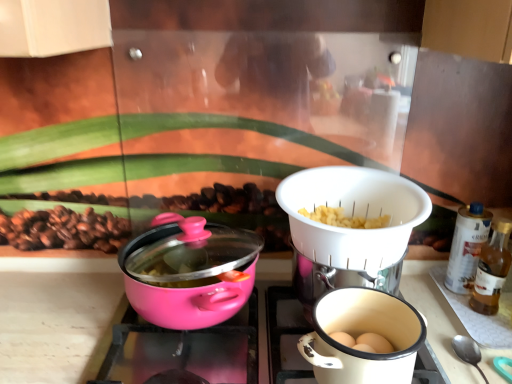
Question: Is matte white coffee cup at lower right bigger than white plastic strainer at center, which is counted as the 1th kitchen appliance, starting from the right?

Choices:
 (A) yes
 (B) no

Answer: (B)

Question: From a real-world perspective, does matte white coffee cup at lower right sit lower than white plastic strainer at center, which is counted as the 1th kitchen appliance, starting from the right?

Choices:
 (A) no
 (B) yes

Answer: (B)

Question: Is matte white coffee cup at lower right not close to white plastic strainer at center, which is counted as the 1th kitchen appliance, starting from the right?

Choices:
 (A) no
 (B) yes

Answer: (A)

Question: Considering the relative sizes of matte white coffee cup at lower right and white plastic strainer at center, marked as the 2th kitchen appliance in a left-to-right arrangement, in the image provided, is matte white coffee cup at lower right thinner than white plastic strainer at center, marked as the 2th kitchen appliance in a left-to-right arrangement,?

Choices:
 (A) yes
 (B) no

Answer: (A)

Question: Is matte white coffee cup at lower right oriented towards white plastic strainer at center, which is counted as the 1th kitchen appliance, starting from the right?

Choices:
 (A) yes
 (B) no

Answer: (B)

Question: In terms of width, does matte white coffee cup at lower right look wider or thinner when compared to white plastic strainer at center, which is counted as the 1th kitchen appliance, starting from the right?

Choices:
 (A) thin
 (B) wide

Answer: (A)

Question: Considering the positions of point (326, 360) and point (359, 241), is point (326, 360) closer or farther from the camera than point (359, 241)?

Choices:
 (A) farther
 (B) closer

Answer: (B)

Question: From a real-world perspective, relative to white plastic strainer at center, which is counted as the 1th kitchen appliance, starting from the right, is matte white coffee cup at lower right vertically above or below?

Choices:
 (A) below
 (B) above

Answer: (A)

Question: In terms of height, does matte white coffee cup at lower right look taller or shorter compared to white plastic strainer at center, marked as the 2th kitchen appliance in a left-to-right arrangement?

Choices:
 (A) tall
 (B) short

Answer: (B)

Question: From the image's perspective, is white plastic strainer at center, marked as the 2th kitchen appliance in a left-to-right arrangement, positioned above or below translucent glass bottle at right?

Choices:
 (A) below
 (B) above

Answer: (B)

Question: Does point (398, 187) appear closer or farther from the camera than point (497, 278)?

Choices:
 (A) closer
 (B) farther

Answer: (A)

Question: Relative to translucent glass bottle at right, is white plastic strainer at center, marked as the 2th kitchen appliance in a left-to-right arrangement, in front or behind?

Choices:
 (A) behind
 (B) front

Answer: (B)

Question: In the image, is white plastic strainer at center, which is counted as the 1th kitchen appliance, starting from the right, on the left side or the right side of translucent glass bottle at right?

Choices:
 (A) left
 (B) right

Answer: (A)

Question: Is translucent glass bottle at right in front of or behind matte white coffee cup at lower right in the image?

Choices:
 (A) behind
 (B) front

Answer: (A)

Question: In terms of height, does translucent glass bottle at right look taller or shorter compared to matte white coffee cup at lower right?

Choices:
 (A) tall
 (B) short

Answer: (A)